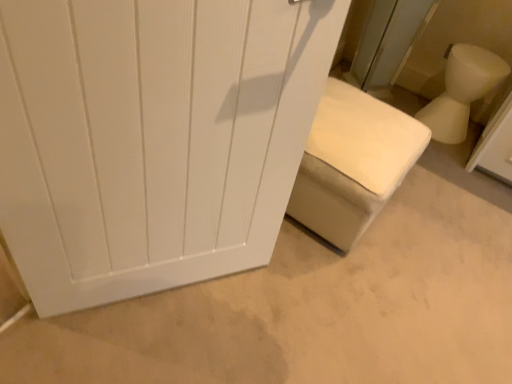
Image resolution: width=512 pixels, height=384 pixels. In order to click on white glossy toilet bowl at upper right in this screenshot , I will do [x=462, y=91].

What do you see at coordinates (462, 91) in the screenshot?
I see `white glossy toilet bowl at upper right` at bounding box center [462, 91].

Measure the distance between point [497,63] and camera.

Point [497,63] is 6.95 feet away from camera.

Find the location of a particular element. Image resolution: width=512 pixels, height=384 pixels. white glossy toilet bowl at upper right is located at coordinates (462, 91).